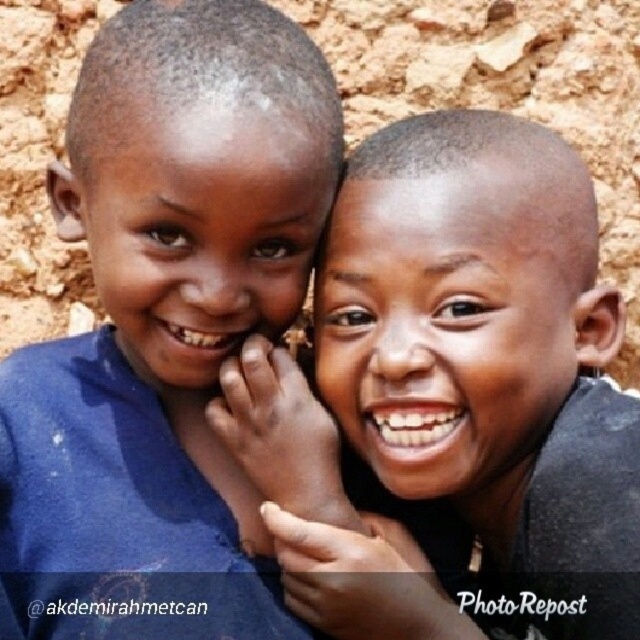
Which is behind, point (129, 467) or point (96, 269)?

Point (129, 467)

Is point (92, 506) positioned behind point (129, 348)?

No, (92, 506) is in front of (129, 348).

This screenshot has height=640, width=640. I want to click on blue fabric shirt at left, so click(x=164, y=324).

Does smooth skin face at center have a larger size compared to matte skin face at center?

Correct, smooth skin face at center is larger in size than matte skin face at center.

Does point (563, 275) lie behind point (266, 330)?

No, (563, 275) is in front of (266, 330).

Identify the location of smooth skin face at center. Image resolution: width=640 pixels, height=640 pixels. (445, 324).

Can you confirm if blue fabric shirt at left is bigger than smooth skin face at center?

Yes.

Can you confirm if blue fabric shirt at left is positioned to the right of smooth skin face at center?

No, blue fabric shirt at left is not to the right of smooth skin face at center.

Describe the element at coordinates (164, 324) in the screenshot. The height and width of the screenshot is (640, 640). I see `blue fabric shirt at left` at that location.

Find the location of a particular element. blue fabric shirt at left is located at coordinates (164, 324).